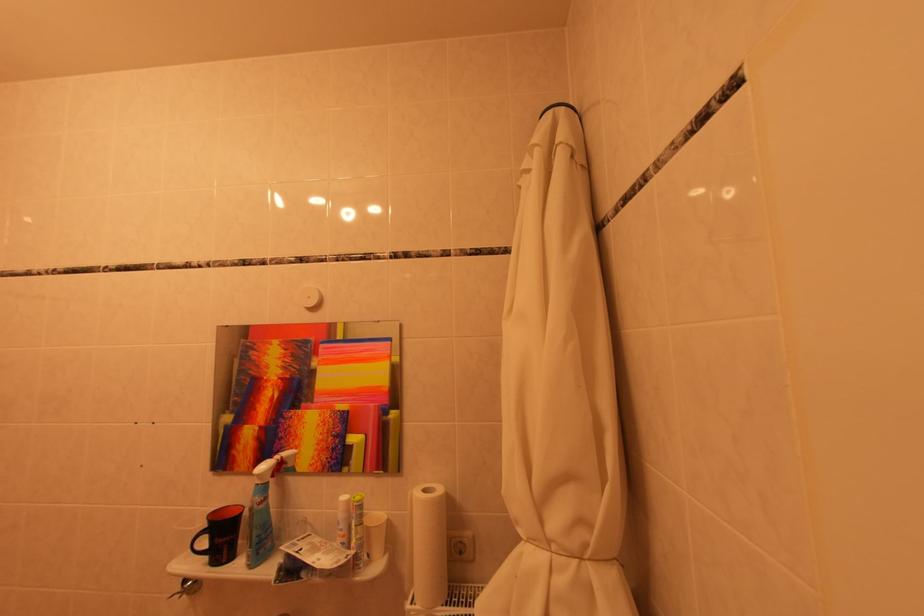
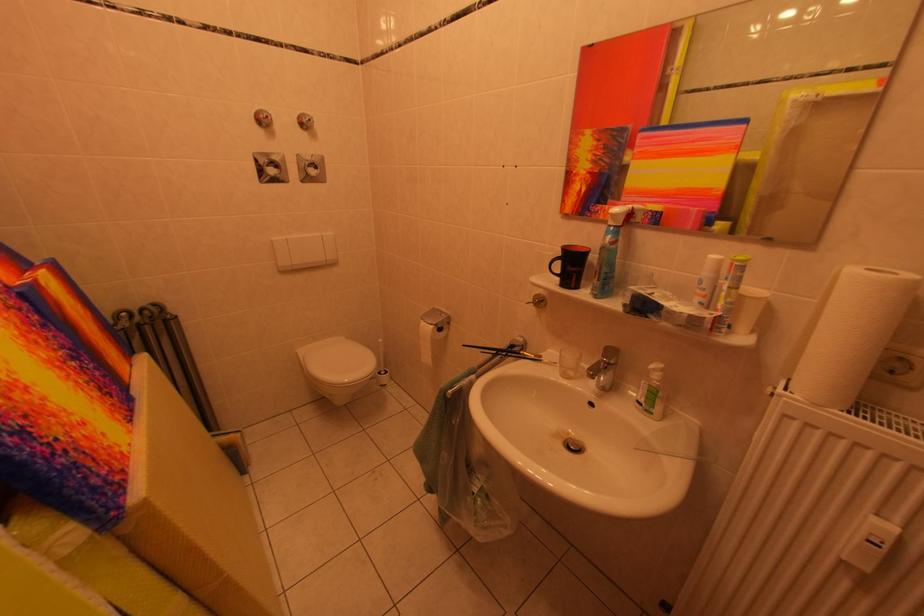
First-person continuous shooting, in which direction is the camera rotating?

The camera rotated toward left-down.